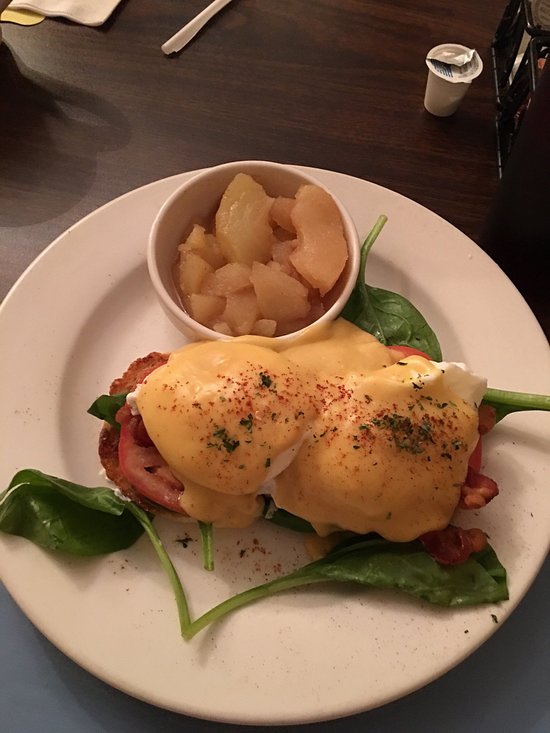
Locate an element on the screen. The width and height of the screenshot is (550, 733). table is located at coordinates 150,119.